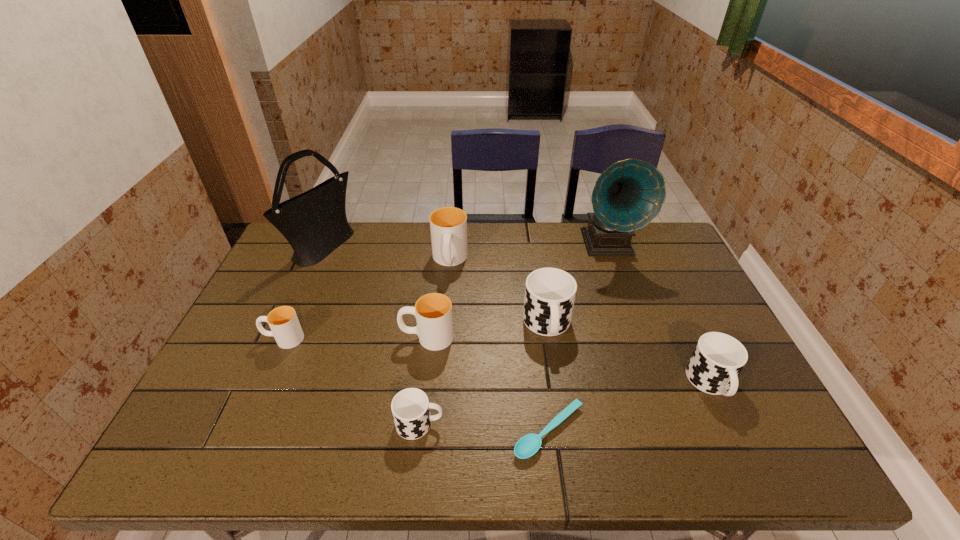
The height and width of the screenshot is (540, 960). In order to click on shoulder bag located at the left edge in this screenshot , I will do `click(314, 223)`.

At what (x,y) coordinates should I click in order to perform the action: click on cup located in the left edge section of the desktop. Please return your answer as a coordinate pair (x, y). Image resolution: width=960 pixels, height=540 pixels. Looking at the image, I should click on (284, 324).

Locate an element on the screen. This screenshot has width=960, height=540. phonograph_record that is positioned at the right edge is located at coordinates (629, 194).

You are a GUI agent. You are given a task and a screenshot of the screen. Output one action in this format:
    pyautogui.click(x=<x>, y=<y>)
    Task: Click on the cup located in the right edge section of the desktop
    Image resolution: width=960 pixels, height=540 pixels.
    Given the screenshot: What is the action you would take?
    pyautogui.click(x=717, y=360)

Where is `object present at the far left corner`? object present at the far left corner is located at coordinates point(314,223).

The image size is (960, 540). Identify the location of object that is at the far right corner. (629, 194).

This screenshot has height=540, width=960. I want to click on vacant space at the far edge of the desktop, so click(x=396, y=245).

Where is `vacant point at the near edge`? The width and height of the screenshot is (960, 540). vacant point at the near edge is located at coordinates (491, 439).

The width and height of the screenshot is (960, 540). I want to click on vacant space at the left edge of the desktop, so click(x=276, y=364).

Locate an element on the screen. Image resolution: width=960 pixels, height=540 pixels. vacant space at the right edge is located at coordinates (652, 294).